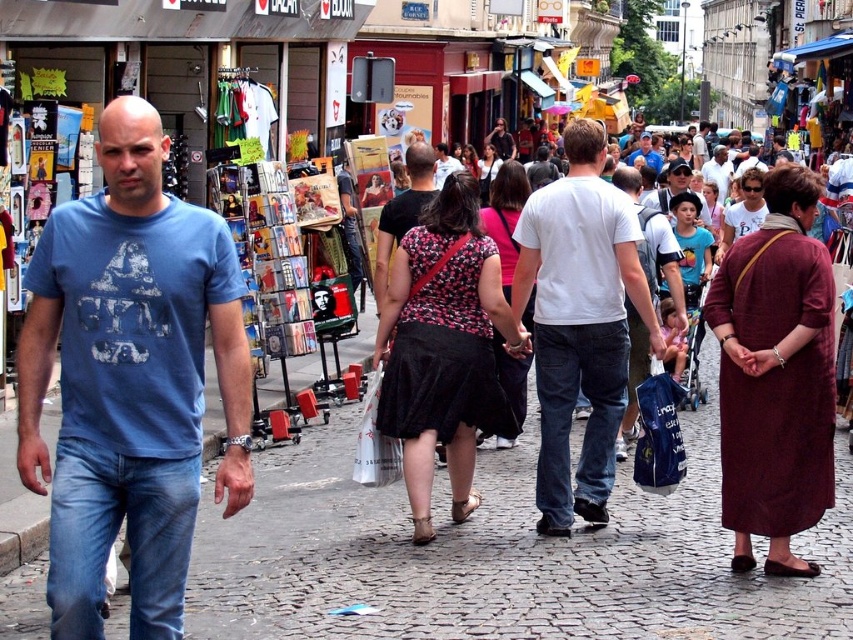
Is matte white shirt at center wider than white cotton shirt at center?

No, matte white shirt at center is not wider than white cotton shirt at center.

Is point (780, 376) positioned after point (718, 200)?

No.

Find the location of a particular element. The height and width of the screenshot is (640, 853). matte white shirt at center is located at coordinates (778, 378).

Where is `matte white shirt at center`? Image resolution: width=853 pixels, height=640 pixels. matte white shirt at center is located at coordinates (778, 378).

Is blue cotton t-shirt at left below white cotton shirt at center?

Yes, blue cotton t-shirt at left is below white cotton shirt at center.

From the picture: Can you confirm if blue cotton t-shirt at left is shorter than white cotton shirt at center?

Correct, blue cotton t-shirt at left is not as tall as white cotton shirt at center.

Identify the location of blue cotton t-shirt at left. (131, 380).

Is matte white shirt at center bigger than white cotton t-shirt at center?

Yes, matte white shirt at center is bigger than white cotton t-shirt at center.

Is matte white shirt at center closer to the viewer compared to white cotton t-shirt at center?

That is True.

Which is behind, point (831, 387) or point (598, 365)?

The point (598, 365) is behind.

Image resolution: width=853 pixels, height=640 pixels. In order to click on matte white shirt at center in this screenshot , I will do `click(778, 378)`.